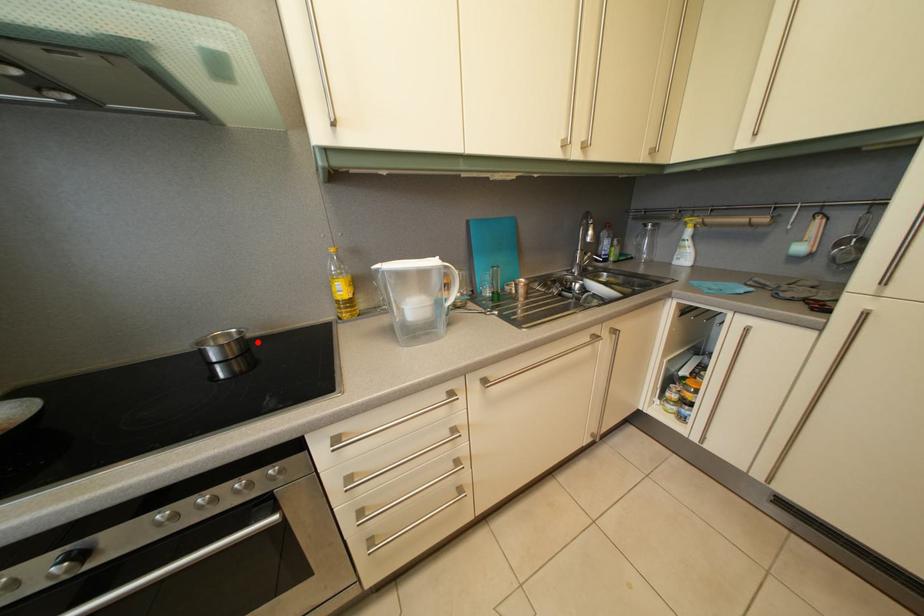
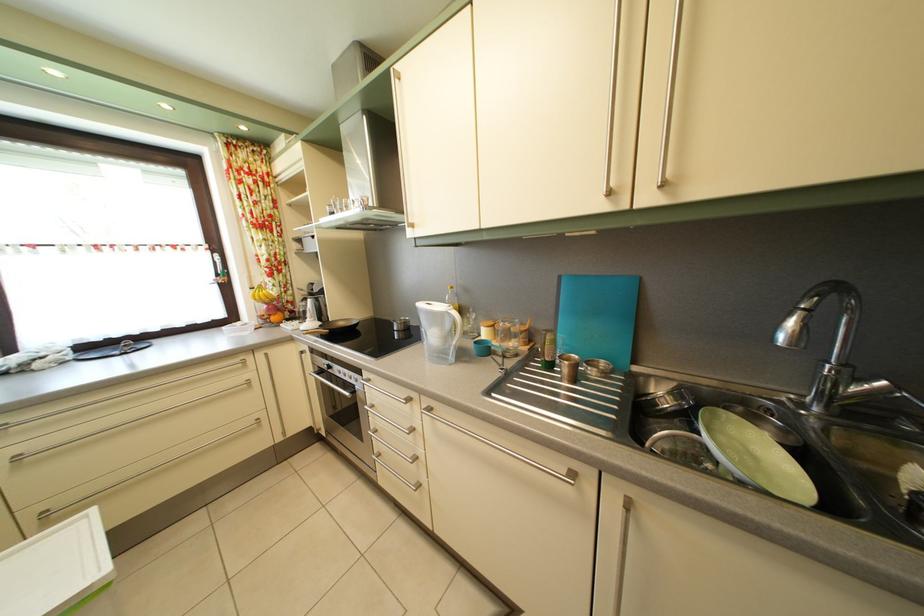
Where in the second image is the point corresponding to the highlighted location from the first image?

(420, 331)